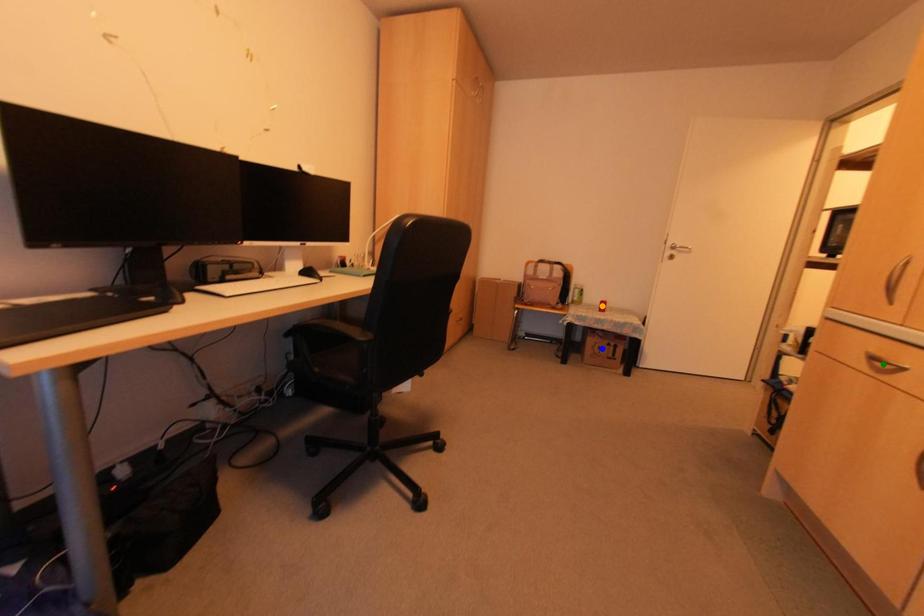
Order these from nearest to farthest:
orange point | blue point | green point

1. orange point
2. blue point
3. green point